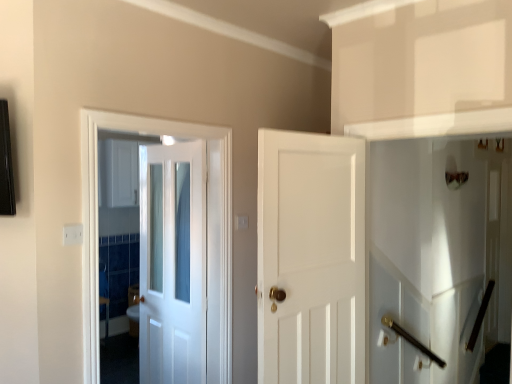
What do you see at coordinates (72, 234) in the screenshot?
I see `white plastic electric outlet at lower left` at bounding box center [72, 234].

What do you see at coordinates (172, 264) in the screenshot?
I see `white glossy door at center, positioned as the first door in left-to-right order` at bounding box center [172, 264].

Find the location of `white glossy door at center, the 1th door when ordered from right to left`. white glossy door at center, the 1th door when ordered from right to left is located at coordinates (311, 258).

Measure the distance between white glossy cabinet at upper left and camera.

The distance of white glossy cabinet at upper left from camera is 4.05 meters.

This screenshot has height=384, width=512. Identify the location of white plastic electric outlet at lower left. (72, 234).

Is white glossy door at center, which appears as the third door when viewed from the right, placed right next to white glossy door at center, placed as the 3th door when sorted from left to right?

No, white glossy door at center, which appears as the third door when viewed from the right, is not with white glossy door at center, placed as the 3th door when sorted from left to right.

Consider the image. Does white glossy door at center, which appears as the third door when viewed from the right, have a larger size compared to white glossy door at center, placed as the 3th door when sorted from left to right?

Yes.

Choose the correct answer: Is white glossy door at center, positioned as the first door in left-to-right order, inside white glossy door at center, placed as the 3th door when sorted from left to right, or outside it?

white glossy door at center, positioned as the first door in left-to-right order, is spatially situated outside white glossy door at center, placed as the 3th door when sorted from left to right.

Which object is wider, white glossy door at center, positioned as the first door in left-to-right order, or white glossy door at center, placed as the 3th door when sorted from left to right?

Wider between the two is white glossy door at center, placed as the 3th door when sorted from left to right.

Measure the distance from white plastic electric outlet at lower left to white glossy cabinet at upper left.

white plastic electric outlet at lower left is 9.02 feet from white glossy cabinet at upper left.

What's the angular difference between white plastic electric outlet at lower left and white glossy cabinet at upper left's facing directions?

white plastic electric outlet at lower left and white glossy cabinet at upper left are facing 2.61 degrees away from each other.

The width and height of the screenshot is (512, 384). Identify the location of cabinetry behind the white plastic electric outlet at lower left. (120, 173).

From a real-world perspective, is white plastic electric outlet at lower left physically located above or below white glossy cabinet at upper left?

Clearly, from a real-world perspective, white plastic electric outlet at lower left is below white glossy cabinet at upper left.

Considering the positions of objects white glossy door at center, the second door positioned from the right, and white glossy door at center, the 1th door when ordered from right to left, in the image provided, who is in front, white glossy door at center, the second door positioned from the right, or white glossy door at center, the 1th door when ordered from right to left,?

white glossy door at center, the 1th door when ordered from right to left.

Considering the sizes of white glossy door at center, the second door in the left-to-right sequence, and white glossy door at center, the 1th door when ordered from right to left, in the image, is white glossy door at center, the second door in the left-to-right sequence, taller or shorter than white glossy door at center, the 1th door when ordered from right to left,?

In the image, white glossy door at center, the second door in the left-to-right sequence, appears to be taller than white glossy door at center, the 1th door when ordered from right to left.

Is white glossy door at center, the second door in the left-to-right sequence, far from white glossy door at center, the 1th door when ordered from right to left?

No, white glossy door at center, the second door in the left-to-right sequence, is not far away from white glossy door at center, the 1th door when ordered from right to left.

Identify the location of elevator that is on the right side of white glossy cabinet at upper left. This screenshot has width=512, height=384. pyautogui.click(x=435, y=254).

Considering the sizes of objects white glossy cabinet at upper left and white glossy elevator at right in the image provided, who is taller, white glossy cabinet at upper left or white glossy elevator at right?

white glossy elevator at right.

Consider the image. From a real-world perspective, is white glossy cabinet at upper left physically located above or below white glossy elevator at right?

white glossy cabinet at upper left is above white glossy elevator at right.

Is white glossy cabinet at upper left spatially inside white glossy elevator at right, or outside of it?

white glossy cabinet at upper left is not inside white glossy elevator at right, it's outside.

Considering the sizes of objects polished brass door handle at lower right and white glossy cabinet at upper left in the image provided, who is smaller, polished brass door handle at lower right or white glossy cabinet at upper left?

polished brass door handle at lower right is smaller.

From the image's perspective, is polished brass door handle at lower right on white glossy cabinet at upper left?

No, from the image's perspective, polished brass door handle at lower right is not on top of white glossy cabinet at upper left.

Is polished brass door handle at lower right looking in the opposite direction of white glossy cabinet at upper left?

That's not correct — polished brass door handle at lower right is not looking away from white glossy cabinet at upper left.

Can you tell me how much polished brass door handle at lower right and white glossy cabinet at upper left differ in facing direction?

The angular difference between polished brass door handle at lower right and white glossy cabinet at upper left is 0.746 degrees.

Between white glossy door at center, which appears as the third door when viewed from the right, and polished brass door handle at lower right, which one appears on the left side from the viewer's perspective?

white glossy door at center, which appears as the third door when viewed from the right, is more to the left.

How many degrees apart are the facing directions of white glossy door at center, positioned as the first door in left-to-right order, and polished brass door handle at lower right?

The angular difference between white glossy door at center, positioned as the first door in left-to-right order, and polished brass door handle at lower right is 92 degrees.

Choose the correct answer: Is white glossy door at center, which appears as the third door when viewed from the right, inside polished brass door handle at lower right or outside it?

white glossy door at center, which appears as the third door when viewed from the right, is not enclosed by polished brass door handle at lower right.

You are a GUI agent. You are given a task and a screenshot of the screen. Output one action in this format:
    pyautogui.click(x=<x>, y=<y>)
    Task: Click on the door handle below the white glossy door at center, positioned as the first door in left-to-right order (from a real-world perspective)
    The height and width of the screenshot is (384, 512).
    Given the screenshot: What is the action you would take?
    pyautogui.click(x=480, y=316)

Would you say white glossy door at center, the 1th door when ordered from right to left, contains white glossy door at center, positioned as the first door in left-to-right order?

No, white glossy door at center, positioned as the first door in left-to-right order, is located outside of white glossy door at center, the 1th door when ordered from right to left.

The image size is (512, 384). Find the location of `the 2nd door below the white glossy door at center, placed as the 3th door when sorted from left to right (from a real-world perspective)`. the 2nd door below the white glossy door at center, placed as the 3th door when sorted from left to right (from a real-world perspective) is located at coordinates (172, 264).

How different are the orientations of white glossy door at center, placed as the 3th door when sorted from left to right, and white glossy door at center, which appears as the third door when viewed from the right, in degrees?

85.8 degrees separate the facing orientations of white glossy door at center, placed as the 3th door when sorted from left to right, and white glossy door at center, which appears as the third door when viewed from the right.

Which is more to the right, white glossy door at center, the 1th door when ordered from right to left, or white glossy door at center, which appears as the third door when viewed from the right?

white glossy door at center, the 1th door when ordered from right to left.

From the image's perspective, which door is the 2nd one above the white glossy door at center, which appears as the third door when viewed from the right? Please provide its 2D coordinates.

[(311, 258)]

I want to click on cabinetry that is on the left side of white plastic electric outlet at lower left, so click(x=120, y=173).

Considering their positions, is white glossy door at center, the second door positioned from the right, positioned closer to polished brass door handle at lower right than white glossy door at center, which appears as the third door when viewed from the right?

Based on the image, white glossy door at center, which appears as the third door when viewed from the right, appears to be nearer to polished brass door handle at lower right.

Based on their spatial positions, is white glossy elevator at right or white glossy door at center, positioned as the first door in left-to-right order, further from white plastic electric outlet at lower left?

The object further to white plastic electric outlet at lower left is white glossy elevator at right.

When comparing their distances from white plastic electric outlet at lower left, does white glossy cabinet at upper left or white glossy elevator at right seem closer?

white glossy cabinet at upper left is closer to white plastic electric outlet at lower left.

From the image, which object appears to be nearer to white glossy door at center, the second door positioned from the right, white glossy elevator at right or white plastic electric outlet at lower left?

The object closer to white glossy door at center, the second door positioned from the right, is white plastic electric outlet at lower left.

When comparing their distances from polished brass door handle at lower right, does white glossy door at center, which appears as the third door when viewed from the right, or white plastic electric outlet at lower left seem further?

white plastic electric outlet at lower left is positioned further to the anchor polished brass door handle at lower right.

Which object lies further to the anchor point white glossy cabinet at upper left, polished brass door handle at lower right or white plastic electric outlet at lower left?

polished brass door handle at lower right.

In the scene shown: When comparing their distances from white glossy door at center, the 1th door when ordered from right to left, does polished brass door handle at lower right or white plastic electric outlet at lower left seem closer?

Based on the image, white plastic electric outlet at lower left appears to be nearer to white glossy door at center, the 1th door when ordered from right to left.

Looking at the image, which one is located further to white glossy door at center, the 1th door when ordered from right to left, white plastic electric outlet at lower left or polished brass door handle at lower right?

Based on the image, polished brass door handle at lower right appears to be further to white glossy door at center, the 1th door when ordered from right to left.

Where is `elevator between white plastic electric outlet at lower left and polished brass door handle at lower right from left to right`? Image resolution: width=512 pixels, height=384 pixels. elevator between white plastic electric outlet at lower left and polished brass door handle at lower right from left to right is located at coordinates (435, 254).

Locate an element on the screen. electric outlet between white glossy cabinet at upper left and polished brass door handle at lower right in the horizontal direction is located at coordinates (72, 234).

The width and height of the screenshot is (512, 384). Identify the location of elevator between white glossy door at center, which appears as the third door when viewed from the right, and polished brass door handle at lower right. (435, 254).

At what (x,y) coordinates should I click in order to perform the action: click on door between white glossy door at center, the second door in the left-to-right sequence, and white glossy cabinet at upper left in the front-back direction. Please return your answer as a coordinate pair (x, y). Looking at the image, I should click on (172, 264).